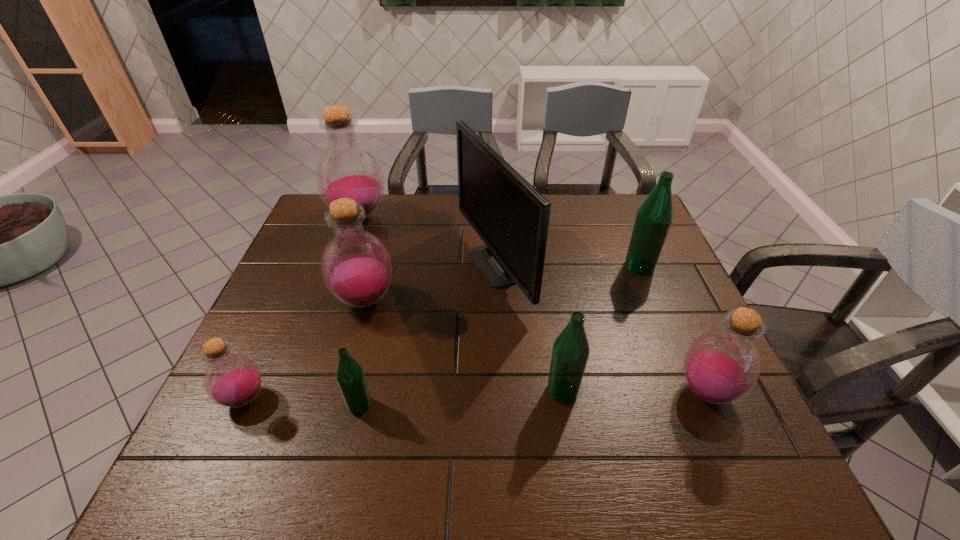
Where is `object that can be found as the fourth closest to the smallest purple bottle`? This screenshot has width=960, height=540. object that can be found as the fourth closest to the smallest purple bottle is located at coordinates (346, 168).

Locate an element on the screen. The height and width of the screenshot is (540, 960). bottle that stands as the fifth closest to the computer monitor is located at coordinates 654,217.

Locate an element on the screen. Image resolution: width=960 pixels, height=540 pixels. bottle that is the fourth nearest to the smallest green bottle is located at coordinates (346, 168).

Select which purple bottle appears as the second closest to the third biggest purple bottle. Please provide its 2D coordinates. Your answer should be formatted as a tuple, i.e. [(x, y)], where the tuple contains the x and y coordinates of a point satisfying the conditions above.

[(232, 380)]

Select which purple bottle is the second closest to the farthest bottle. Please provide its 2D coordinates. Your answer should be formatted as a tuple, i.e. [(x, y)], where the tuple contains the x and y coordinates of a point satisfying the conditions above.

[(232, 380)]

Identify which green bottle is the second closest to the smallest green bottle. Please provide its 2D coordinates. Your answer should be formatted as a tuple, i.e. [(x, y)], where the tuple contains the x and y coordinates of a point satisfying the conditions above.

[(654, 217)]

Image resolution: width=960 pixels, height=540 pixels. Find the location of `the second closest green bottle relative to the second biggest green bottle`. the second closest green bottle relative to the second biggest green bottle is located at coordinates (654, 217).

The height and width of the screenshot is (540, 960). What are the coordinates of `vacant space that satisfies the following two spatial constraints: 1. on the front-facing side of the third biggest purple bottle; 2. on the right side of the computer monitor` in the screenshot? It's located at (498, 392).